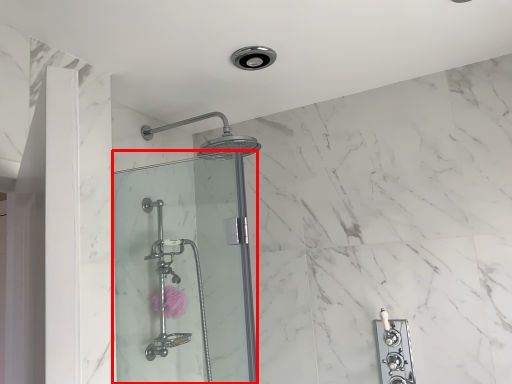
Question: Where is shower door (annotated by the red box) located in relation to flower in the image?

Choices:
 (A) right
 (B) left

Answer: (A)